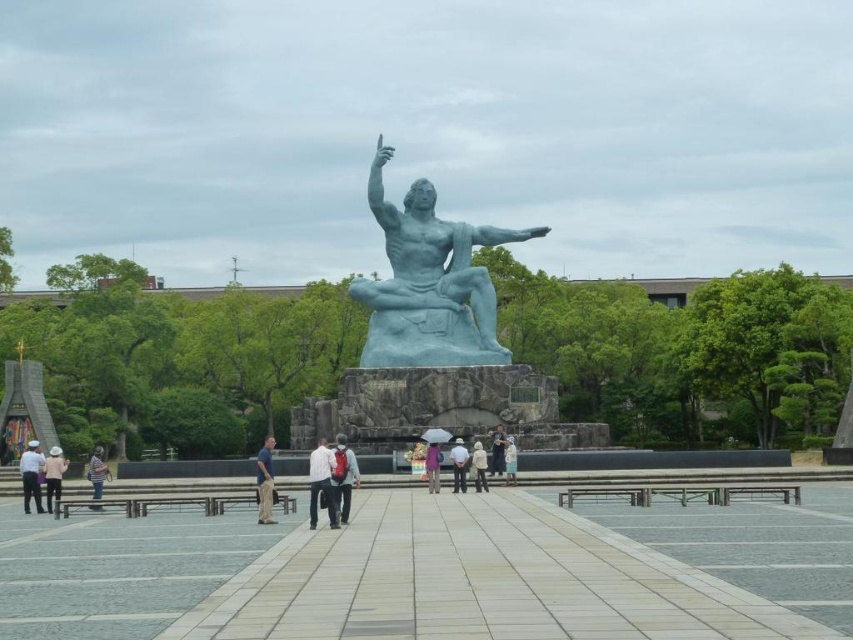
Does blue polished statue at center appear under blue stone statue at center?

Actually, blue polished statue at center is above blue stone statue at center.

Who is taller, blue polished statue at center or blue stone statue at center?

With more height is blue polished statue at center.

Does point (447, 364) come behind point (502, 426)?

That is True.

The width and height of the screenshot is (853, 640). Identify the location of blue polished statue at center. (428, 284).

Does blue polished stone statue at center appear on the right side of white hat at lower left?

Indeed, blue polished stone statue at center is positioned on the right side of white hat at lower left.

Does blue polished stone statue at center appear on the left side of white hat at lower left?

No, blue polished stone statue at center is not to the left of white hat at lower left.

Where is `blue polished stone statue at center`? This screenshot has width=853, height=640. blue polished stone statue at center is located at coordinates (434, 340).

At what (x,y) coordinates should I click in order to perform the action: click on blue polished stone statue at center. Please return your answer as a coordinate pair (x, y). The image size is (853, 640). Looking at the image, I should click on (434, 340).

Is white matte shirt at center to the right of matte blue statue at center from the viewer's perspective?

Incorrect, white matte shirt at center is not on the right side of matte blue statue at center.

Does white matte shirt at center appear under matte blue statue at center?

Indeed, white matte shirt at center is positioned under matte blue statue at center.

Who is more forward, (329, 520) or (341, 509)?

Positioned in front is point (329, 520).

This screenshot has height=640, width=853. In order to click on white matte shirt at center in this screenshot , I will do `click(321, 483)`.